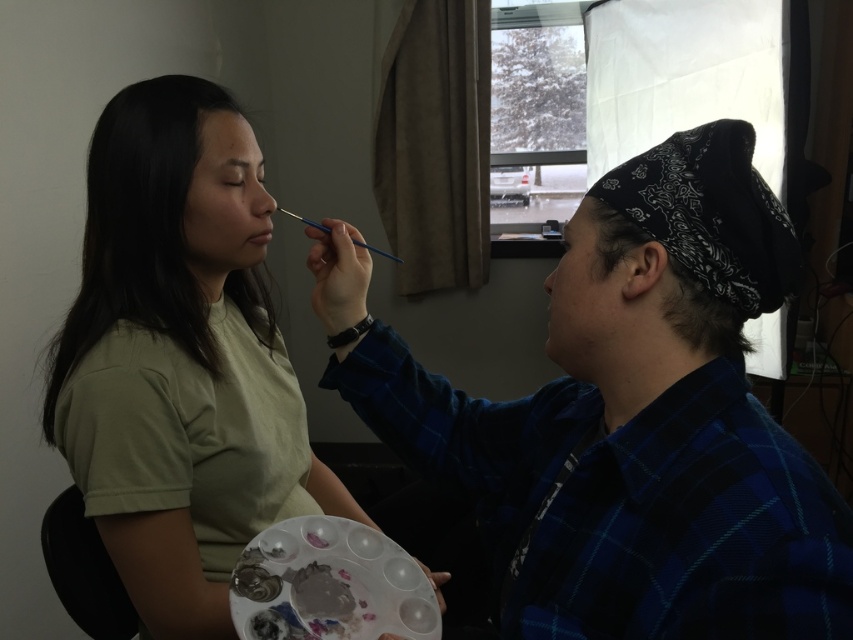
Does matte green shirt at left come behind matte skin forehead at upper center?

No, matte green shirt at left is in front of matte skin forehead at upper center.

Which is above, matte green shirt at left or matte skin forehead at upper center?

matte skin forehead at upper center is higher up.

The image size is (853, 640). What do you see at coordinates (178, 365) in the screenshot? I see `matte green shirt at left` at bounding box center [178, 365].

Where is `matte green shirt at left`? The height and width of the screenshot is (640, 853). matte green shirt at left is located at coordinates (178, 365).

Who is positioned more to the right, matte black bandana at right or matte skin forehead at upper center?

matte black bandana at right

Is matte black bandana at right further to the viewer compared to matte skin forehead at upper center?

That is False.

This screenshot has height=640, width=853. Identify the location of matte black bandana at right. (589, 296).

Can you confirm if blue plaid shirt at right is taller than matte green shirt at left?

In fact, blue plaid shirt at right may be shorter than matte green shirt at left.

Does blue plaid shirt at right appear on the right side of matte green shirt at left?

Correct, you'll find blue plaid shirt at right to the right of matte green shirt at left.

Between point (630, 180) and point (109, 113), which one is positioned behind?

Positioned behind is point (109, 113).

Identify the location of blue plaid shirt at right. (630, 426).